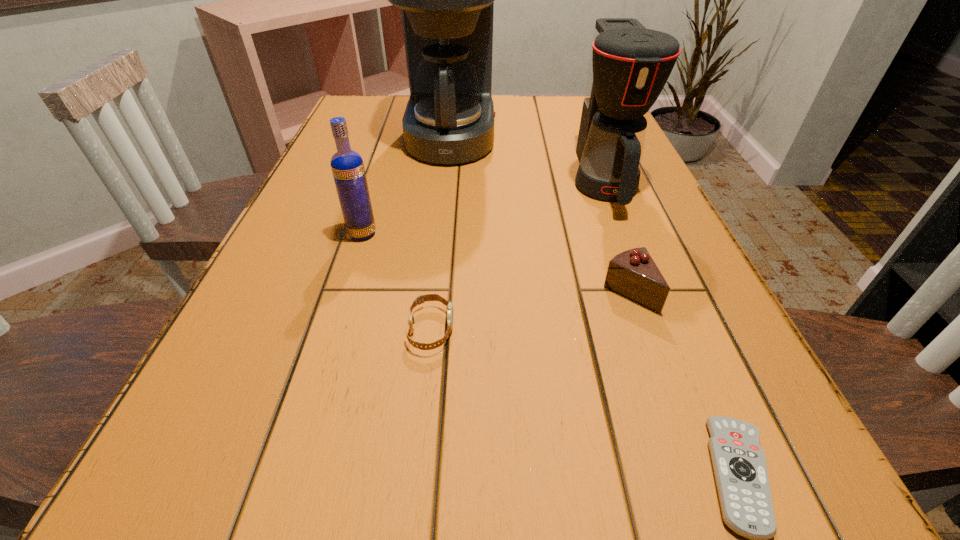
In the image, there is a desktop. At what (x,y) coordinates should I click in order to perform the action: click on free space at the far left corner. Please return your answer as a coordinate pair (x, y). Looking at the image, I should click on (364, 94).

The height and width of the screenshot is (540, 960). In order to click on vacant space at the far right corner of the desktop in this screenshot , I will do `click(569, 102)`.

Find the location of a particular element. The height and width of the screenshot is (540, 960). vacant space that is in between the second tallest object and the third shortest object is located at coordinates (616, 237).

You are a GUI agent. You are given a task and a screenshot of the screen. Output one action in this format:
    pyautogui.click(x=<x>, y=<y>)
    Task: Click on the vacant point located between the right coffee maker and the left coffee maker
    
    Given the screenshot: What is the action you would take?
    pyautogui.click(x=528, y=160)

Identify the location of blank region between the second tallest object and the fourth shortest object. (483, 208).

Where is `vacant area between the leftmost object and the left coffee maker`? vacant area between the leftmost object and the left coffee maker is located at coordinates (407, 186).

Identify the location of vacant region between the third shortest object and the third farthest object. The width and height of the screenshot is (960, 540). (495, 263).

In order to click on blank region between the watch and the leftmost object in this screenshot , I will do `click(396, 282)`.

Identify the location of vacant point located between the fifth shortest object and the vodka. (483, 208).

Locate which object is the fourth closest to the shorter coffee maker. Please provide its 2D coordinates. Your answer should be formatted as a tuple, i.e. [(x, y)], where the tuple contains the x and y coordinates of a point satisfying the conditions above.

[(347, 166)]